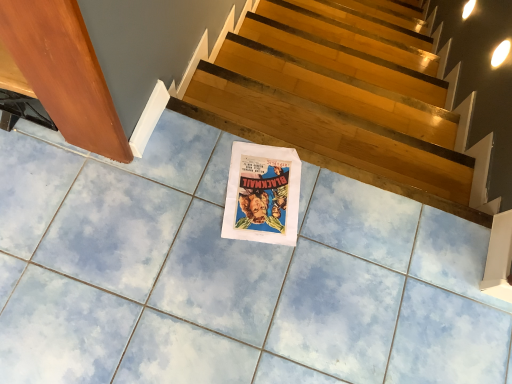
Question: From the image's perspective, is white paper at center located above wooden at upper center?

Choices:
 (A) no
 (B) yes

Answer: (A)

Question: Can you confirm if white paper at center is taller than wooden at upper center?

Choices:
 (A) yes
 (B) no

Answer: (B)

Question: Does white paper at center have a smaller size compared to wooden at upper center?

Choices:
 (A) no
 (B) yes

Answer: (B)

Question: Is white paper at center turned away from wooden at upper center?

Choices:
 (A) yes
 (B) no

Answer: (B)

Question: From a real-world perspective, does white paper at center stand above wooden at upper center?

Choices:
 (A) no
 (B) yes

Answer: (B)

Question: Would you say white paper at center contains wooden at upper center?

Choices:
 (A) no
 (B) yes

Answer: (A)

Question: From the image's perspective, does wooden at upper center appear higher than white paper at center?

Choices:
 (A) yes
 (B) no

Answer: (A)

Question: Could you tell me if wooden at upper center is turned towards white paper at center?

Choices:
 (A) no
 (B) yes

Answer: (A)

Question: Can you confirm if wooden at upper center is smaller than white paper at center?

Choices:
 (A) yes
 (B) no

Answer: (B)

Question: Is wooden at upper center not within white paper at center?

Choices:
 (A) yes
 (B) no

Answer: (A)

Question: Can you confirm if wooden at upper center is thinner than white paper at center?

Choices:
 (A) no
 (B) yes

Answer: (B)

Question: From a real-world perspective, is wooden at upper center under white paper at center?

Choices:
 (A) yes
 (B) no

Answer: (A)

Question: Is point (414, 130) positioned closer to the camera than point (240, 168)?

Choices:
 (A) farther
 (B) closer

Answer: (A)